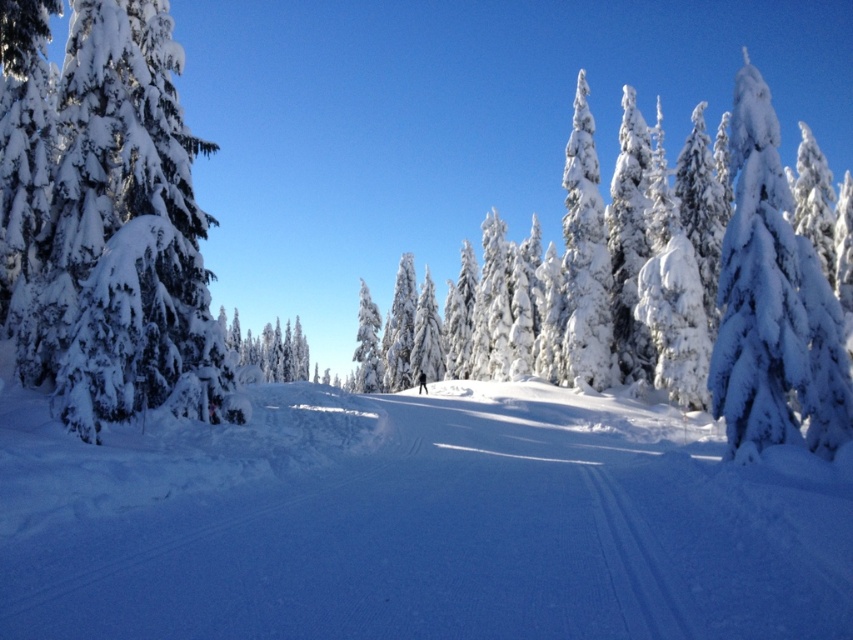
Looking at this image, how distant is white fluffy snow-covered tree at left from black matte skier at center?

35.00 meters

Which is above, white fluffy snow-covered tree at left or black matte skier at center?

Positioned higher is white fluffy snow-covered tree at left.

Who is more distant from viewer, [167,193] or [426,392]?

Point [426,392]

At what (x,y) coordinates should I click in order to perform the action: click on white fluffy snow-covered tree at left. Please return your answer as a coordinate pair (x, y). The image size is (853, 640). Looking at the image, I should click on point(122,236).

Which is more to the right, white snow-covered trees at center or black matte skier at center?

white snow-covered trees at center

Between white snow-covered trees at center and black matte skier at center, which one has less height?

With less height is black matte skier at center.

Between point (776, 282) and point (418, 372), which one is positioned in front?

Point (776, 282) is in front.

The width and height of the screenshot is (853, 640). I want to click on white snow-covered trees at center, so click(x=747, y=300).

Based on the photo, who is lower down, white snow-covered tree at center or black matte skier at center?

black matte skier at center is below.

Find the location of a particular element. white snow-covered tree at center is located at coordinates (271, 349).

Where is `white snow-covered tree at center`? white snow-covered tree at center is located at coordinates (271, 349).